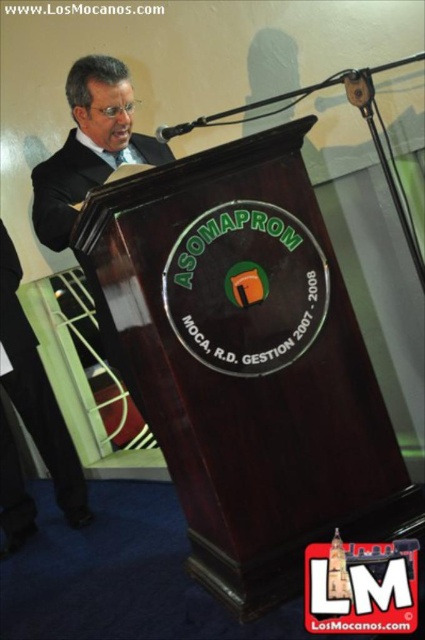
Does matte black suit at left appear under black satin business suit at left?

No, matte black suit at left is not below black satin business suit at left.

At what (x,y) coordinates should I click in order to perform the action: click on matte black suit at left. Please return your answer as a coordinate pair (x, y). Image resolution: width=425 pixels, height=640 pixels. Looking at the image, I should click on (88, 147).

Find the location of a particular element. The height and width of the screenshot is (640, 425). matte black suit at left is located at coordinates (88, 147).